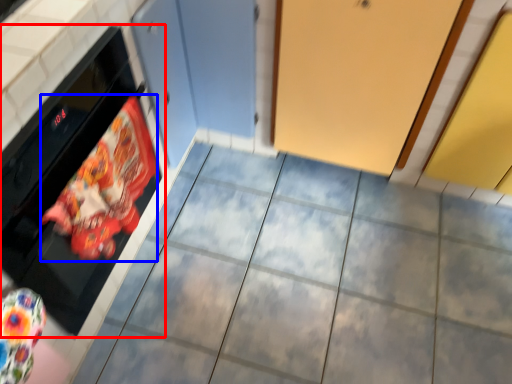
Question: Which object is closer to the camera taking this photo, oven (highlighted by a red box) or material (highlighted by a blue box)?

Choices:
 (A) oven
 (B) material

Answer: (A)